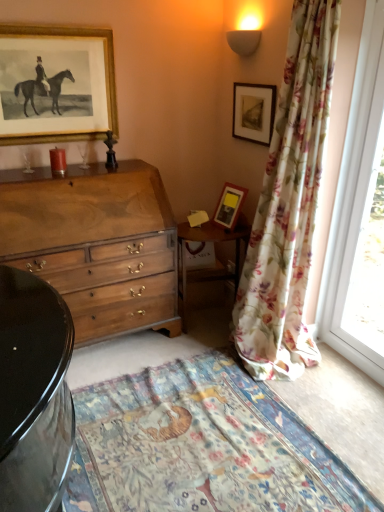
I want to click on blank area beneath wooden table at center (from a real-world perspective), so click(x=206, y=321).